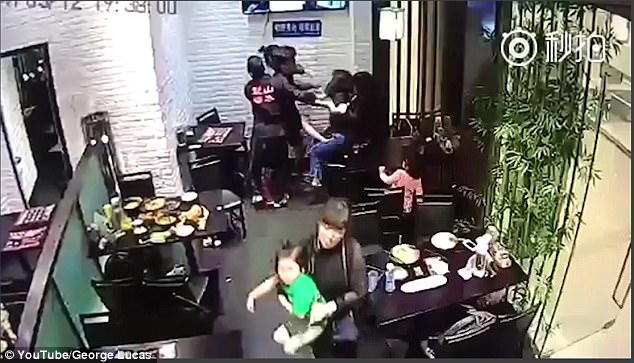
Identify the location of door. The image size is (634, 363). (18, 147).